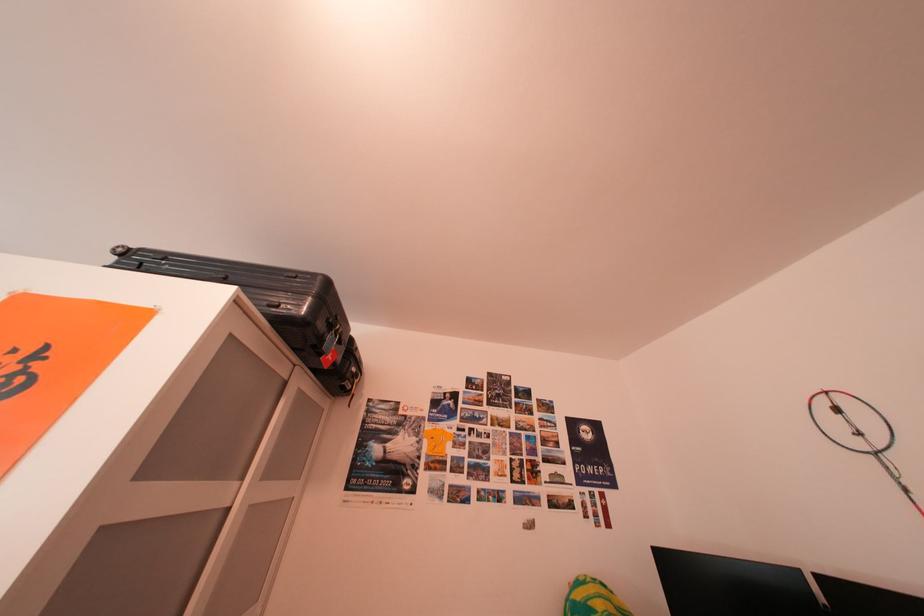
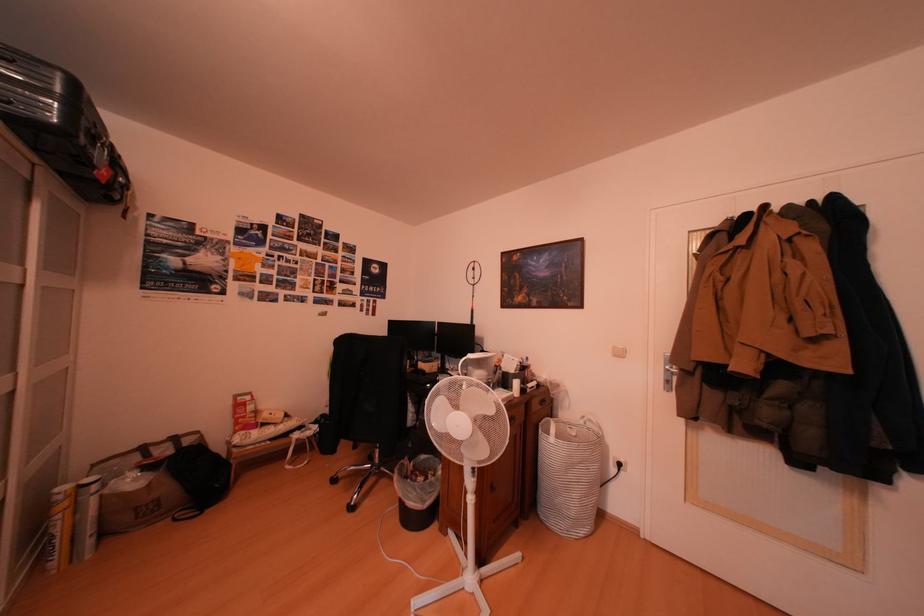
Locate, in the second image, the point that corresponds to the point at 289,310 in the first image.

(19, 108)